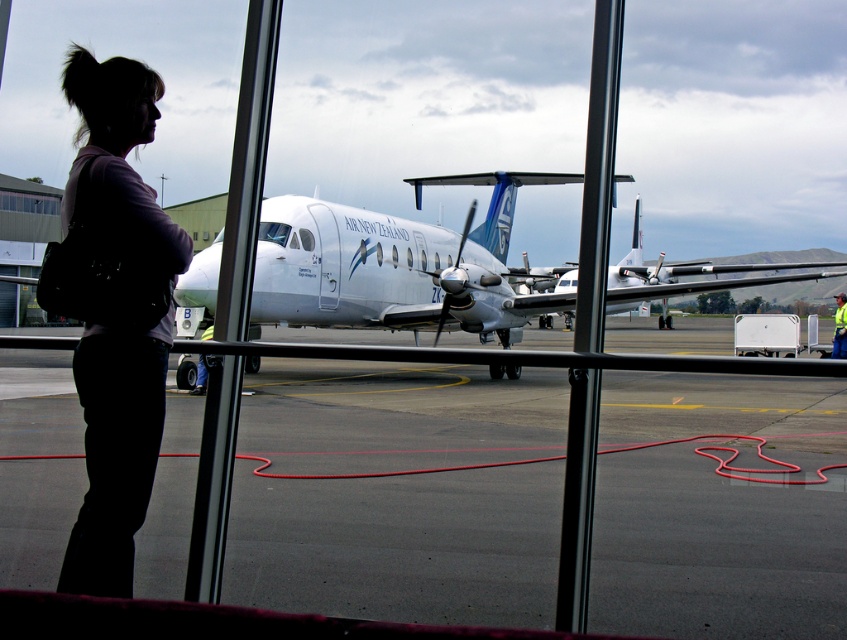
You are standing at the airport window and want to know the exact location of the black asphalt tarmac at center. Can you determine its coordinates based on the scene?

The black asphalt tarmac at center is located at point (399, 545).

Based on the photo, you are a passenger at the airport and notice the silhouette fabric bag at left and the yellow reflective vest at lower right through the window. Which object is positioned higher in the image?

The silhouette fabric bag at left is located above the yellow reflective vest at lower right, so it is positioned higher in the image.

You are standing in an airport terminal and see the silhouette fabric bag at left. If you want to place it on the window frame metal, which is located at the center of the window, would it fit? The window frame metal is 0.5 meters wide and the bag is 0.4 meters wide.

The silhouette fabric bag at left is 0.4 meters wide and the window frame metal is 0.5 meters wide, so the bag would fit on the window frame metal.